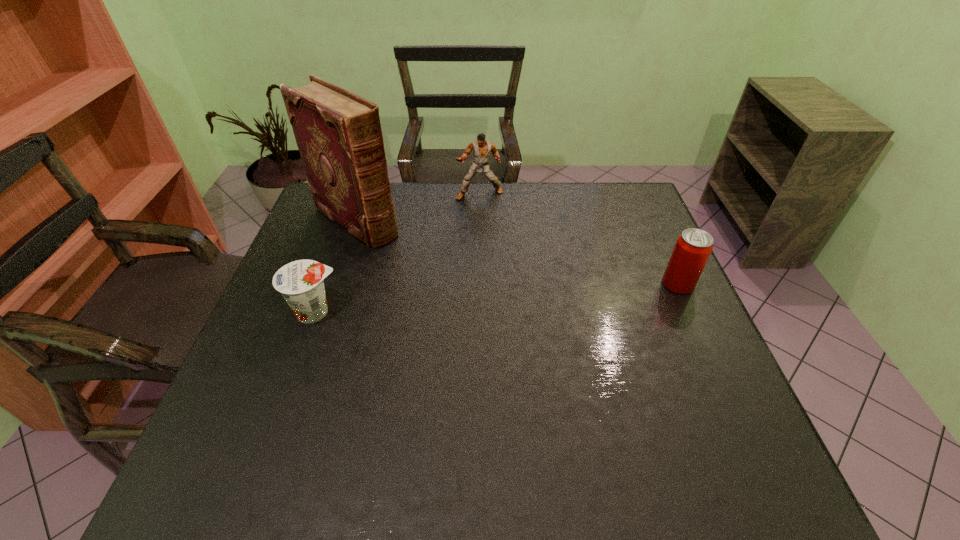
The height and width of the screenshot is (540, 960). Identify the location of vacant space on the desktop that is between the shortest object and the third tallest object and is positioned on the front-facing side of the third shortest object. (491, 299).

Image resolution: width=960 pixels, height=540 pixels. I want to click on free spot on the desktop that is between the yogurt and the third tallest object and is positioned on the spine side of the tallest object, so click(470, 300).